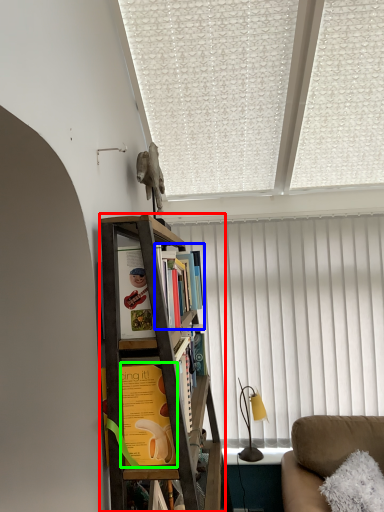
Question: Which object is positioned farthest from bookcase (highlighted by a red box)? Select from book (highlighted by a blue box) and book (highlighted by a green box).

Choices:
 (A) book
 (B) book

Answer: (A)